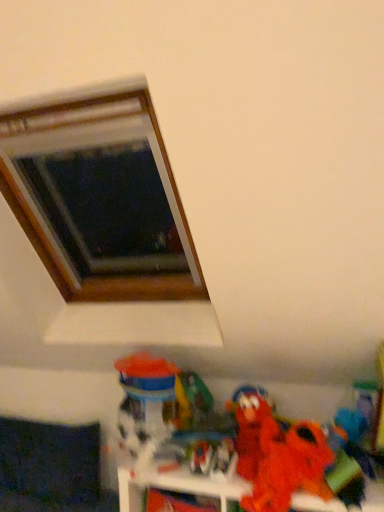
Question: Is matte plastic toy at lower center, arranged as the third toy when viewed from the right, aimed at translucent plastic toy at lower center, which ranks as the first toy in left-to-right order?

Choices:
 (A) yes
 (B) no

Answer: (B)

Question: Considering the relative sizes of matte plastic toy at lower center, arranged as the third toy when viewed from the right, and translucent plastic toy at lower center, which ranks as the first toy in left-to-right order, in the image provided, is matte plastic toy at lower center, arranged as the third toy when viewed from the right, bigger than translucent plastic toy at lower center, which ranks as the first toy in left-to-right order,?

Choices:
 (A) yes
 (B) no

Answer: (B)

Question: Is matte plastic toy at lower center, arranged as the third toy when viewed from the right, beside translucent plastic toy at lower center, which ranks as the first toy in left-to-right order?

Choices:
 (A) yes
 (B) no

Answer: (B)

Question: Considering the relative positions of matte plastic toy at lower center, arranged as the third toy when viewed from the right, and translucent plastic toy at lower center, acting as the 5th toy starting from the right, in the image provided, is matte plastic toy at lower center, arranged as the third toy when viewed from the right, behind translucent plastic toy at lower center, acting as the 5th toy starting from the right,?

Choices:
 (A) no
 (B) yes

Answer: (A)

Question: Would you say translucent plastic toy at lower center, which ranks as the first toy in left-to-right order, is part of matte plastic toy at lower center, arranged as the third toy when viewed from the right,'s contents?

Choices:
 (A) yes
 (B) no

Answer: (B)

Question: Is translucent plastic toy at lower center, which ranks as the first toy in left-to-right order, at the back of matte plastic toy at lower center, arranged as the third toy when viewed from the right?

Choices:
 (A) no
 (B) yes

Answer: (A)

Question: Considering the relative sizes of fuzzy red plush at lower right, which is the first toy from right to left, and matte red plush at lower right, placed as the second toy when sorted from right to left, in the image provided, is fuzzy red plush at lower right, which is the first toy from right to left, bigger than matte red plush at lower right, placed as the second toy when sorted from right to left,?

Choices:
 (A) yes
 (B) no

Answer: (A)

Question: From the image's perspective, is fuzzy red plush at lower right, which is the first toy from right to left, located above matte red plush at lower right, acting as the fourth toy starting from the left?

Choices:
 (A) no
 (B) yes

Answer: (A)

Question: Is fuzzy red plush at lower right, which is the first toy from right to left, smaller than matte red plush at lower right, acting as the fourth toy starting from the left?

Choices:
 (A) yes
 (B) no

Answer: (B)

Question: Is fuzzy red plush at lower right, which is the first toy from right to left, wider than matte red plush at lower right, acting as the fourth toy starting from the left?

Choices:
 (A) yes
 (B) no

Answer: (B)

Question: Is fuzzy red plush at lower right, arranged as the fifth toy when viewed from the left, at the left side of matte red plush at lower right, placed as the second toy when sorted from right to left?

Choices:
 (A) yes
 (B) no

Answer: (B)

Question: Is the depth of fuzzy red plush at lower right, which is the first toy from right to left, greater than that of matte red plush at lower right, acting as the fourth toy starting from the left?

Choices:
 (A) yes
 (B) no

Answer: (B)

Question: Is fuzzy fabric plush at lower right bigger than translucent plastic toy at lower center, acting as the 5th toy starting from the right?

Choices:
 (A) no
 (B) yes

Answer: (B)